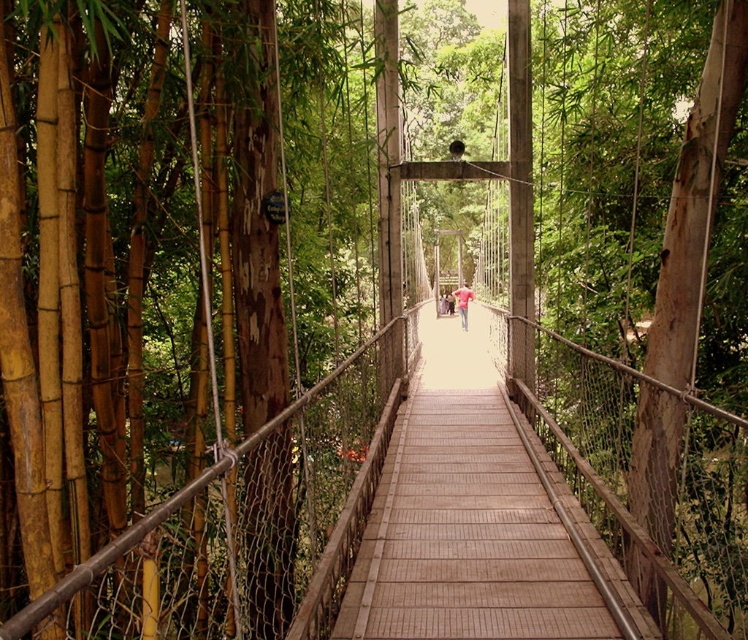
Is wooden bridge at center in front of pink fabric shirt at center?

Yes, it is.

Does wooden bridge at center have a greater height compared to pink fabric shirt at center?

No, wooden bridge at center is not taller than pink fabric shirt at center.

Which is in front, point (423, 532) or point (465, 307)?

Point (423, 532) is more forward.

Image resolution: width=748 pixels, height=640 pixels. In order to click on wooden bridge at center in this screenshot , I will do `click(476, 518)`.